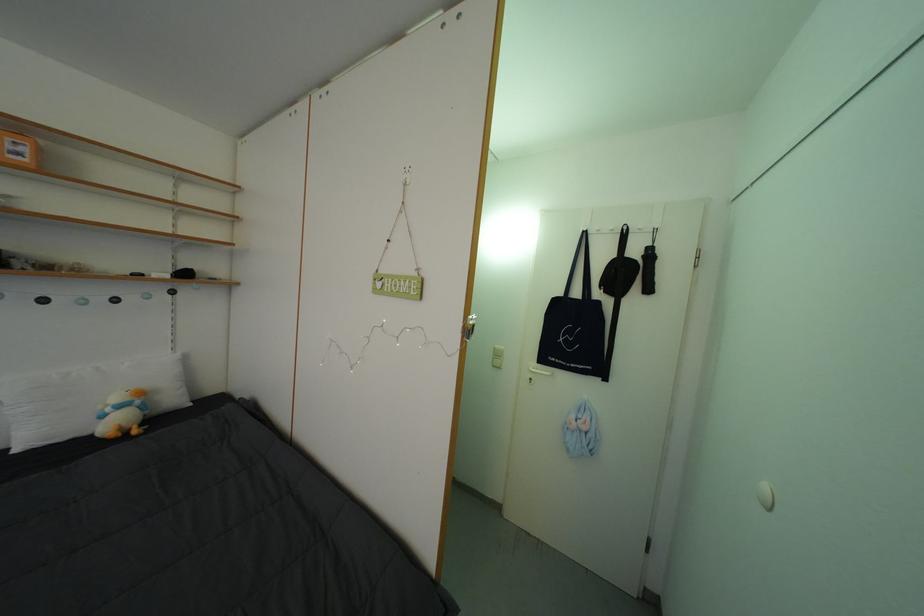
What are the coordinates of `white door handle` in the screenshot? It's located at (539, 373).